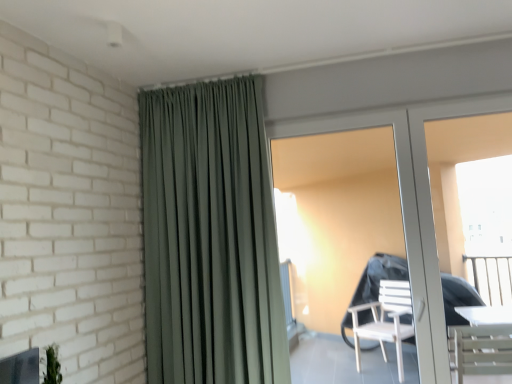
Question: Looking at the image, does white glossy screen door at right seem bigger or smaller compared to white glossy door at center?

Choices:
 (A) big
 (B) small

Answer: (B)

Question: Is white glossy screen door at right taller or shorter than white glossy door at center?

Choices:
 (A) tall
 (B) short

Answer: (B)

Question: Estimate the real-world distances between objects in this image. Which object is closer to the white glossy door at center?

Choices:
 (A) satin green curtain at upper center
 (B) white glossy screen door at right

Answer: (B)

Question: Estimate the real-world distances between objects in this image. Which object is farther from the white glossy screen door at right?

Choices:
 (A) white glossy door at center
 (B) satin green curtain at upper center

Answer: (B)